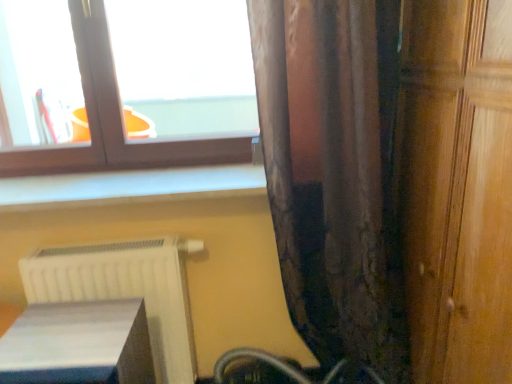
Locate an element on the screen. The image size is (512, 384). matte brown window at upper left is located at coordinates (124, 84).

You are a GUI agent. You are given a task and a screenshot of the screen. Output one action in this format:
    pyautogui.click(x=<x>, y=<y>)
    Task: Click on the wooden door at right
    This screenshot has height=384, width=512.
    Given the screenshot: What is the action you would take?
    pyautogui.click(x=458, y=188)

Locate an element on the screen. The width and height of the screenshot is (512, 384). white matte radiator at lower left is located at coordinates (126, 290).

The width and height of the screenshot is (512, 384). I want to click on white glossy book at lower left, so click(78, 344).

Describe the element at coordinates (78, 344) in the screenshot. I see `white glossy book at lower left` at that location.

Measure the distance between point (357, 206) and camera.

The depth of point (357, 206) is 4.07 feet.

What do you see at coordinates (334, 173) in the screenshot? I see `brown textured curtain at right` at bounding box center [334, 173].

This screenshot has height=384, width=512. What are the coordinates of `matte brown window at upper left` in the screenshot? It's located at (124, 84).

Who is taller, brown textured curtain at right or white matte radiator at lower left?

brown textured curtain at right.

Is brown textured curtain at right positioned far away from white matte radiator at lower left?

That's not correct — brown textured curtain at right is a little close to white matte radiator at lower left.

Is point (263, 64) closer or farther from the camera than point (169, 368)?

Point (263, 64).

Which object is positioned more to the right, brown textured curtain at right or white matte radiator at lower left?

brown textured curtain at right is more to the right.

From the picture: Considering the relative positions of white matte radiator at lower left and matte brown window at upper left in the image provided, is white matte radiator at lower left to the left or to the right of matte brown window at upper left?

From the image, it's evident that white matte radiator at lower left is to the right of matte brown window at upper left.

Which object is thinner, white matte radiator at lower left or matte brown window at upper left?

Thinner between the two is matte brown window at upper left.

How many degrees apart are the facing directions of white matte radiator at lower left and matte brown window at upper left?

1.24 degrees.

How much distance is there between white matte radiator at lower left and matte brown window at upper left?

white matte radiator at lower left and matte brown window at upper left are 24.09 inches apart.

Which object is positioned more to the right, brown textured curtain at right or white glossy book at lower left?

From the viewer's perspective, brown textured curtain at right appears more on the right side.

From the image's perspective, which is below, brown textured curtain at right or white glossy book at lower left?

white glossy book at lower left, from the image's perspective.

Considering the sizes of objects brown textured curtain at right and white glossy book at lower left in the image provided, who is shorter, brown textured curtain at right or white glossy book at lower left?

With less height is white glossy book at lower left.

Can you confirm if white matte radiator at lower left is wider than white glossy book at lower left?

In fact, white matte radiator at lower left might be narrower than white glossy book at lower left.

From the picture: Is white matte radiator at lower left bigger or smaller than white glossy book at lower left?

Considering their sizes, white matte radiator at lower left takes up more space than white glossy book at lower left.

In the scene shown: From a real-world perspective, does white matte radiator at lower left stand above white glossy book at lower left?

Incorrect, from a real-world perspective, white matte radiator at lower left is lower than white glossy book at lower left.

From the image's perspective, is matte brown window at upper left located beneath white matte radiator at lower left?

Incorrect, from the image's perspective, matte brown window at upper left is higher than white matte radiator at lower left.

Does point (65, 10) appear closer or farther from the camera than point (182, 270)?

Point (65, 10).

Consider the image. Is matte brown window at upper left facing away from white matte radiator at lower left?

No.

Could wooden door at right be considered to be inside brown textured curtain at right?

Definitely not — wooden door at right is not inside brown textured curtain at right.

Can you tell me how much brown textured curtain at right and wooden door at right differ in facing direction?

The angular difference between brown textured curtain at right and wooden door at right is 90.1 degrees.

Is brown textured curtain at right turned away from wooden door at right?

That's not correct — brown textured curtain at right is not looking away from wooden door at right.

You are a GUI agent. You are given a task and a screenshot of the screen. Output one action in this format:
    pyautogui.click(x=<x>, y=<y>)
    Task: Click on the door in front of the brown textured curtain at right
    
    Given the screenshot: What is the action you would take?
    pyautogui.click(x=458, y=188)

Looking at the image, does matte brown window at upper left seem bigger or smaller compared to brown textured curtain at right?

In the image, matte brown window at upper left appears to be smaller than brown textured curtain at right.

Consider the image. From the image's perspective, which one is positioned lower, matte brown window at upper left or brown textured curtain at right?

From the image's view, brown textured curtain at right is below.

From the picture: From a real-world perspective, is matte brown window at upper left above or below brown textured curtain at right?

matte brown window at upper left is situated higher than brown textured curtain at right in the real world.

The height and width of the screenshot is (384, 512). I want to click on radiator on the left of the brown textured curtain at right, so point(126,290).

The width and height of the screenshot is (512, 384). In order to click on radiator lying behind the matte brown window at upper left in this screenshot , I will do `click(126, 290)`.

From the image, which object appears to be farther from wooden door at right, white matte radiator at lower left or matte brown window at upper left?

matte brown window at upper left is further to wooden door at right.

Estimate the real-world distances between objects in this image. Which object is closer to white glossy book at lower left, white matte radiator at lower left or brown textured curtain at right?

white matte radiator at lower left is closer to white glossy book at lower left.

Considering their positions, is white matte radiator at lower left positioned closer to white glossy book at lower left than matte brown window at upper left?

Among the two, white matte radiator at lower left is located nearer to white glossy book at lower left.

Looking at the image, which one is located closer to wooden door at right, brown textured curtain at right or white glossy book at lower left?

brown textured curtain at right.

Consider the image. When comparing their distances from matte brown window at upper left, does brown textured curtain at right or wooden door at right seem closer?

brown textured curtain at right is positioned closer to the anchor matte brown window at upper left.

From the image, which object appears to be nearer to brown textured curtain at right, white matte radiator at lower left or wooden door at right?

wooden door at right.

Based on their spatial positions, is matte brown window at upper left or white glossy book at lower left further from brown textured curtain at right?

white glossy book at lower left is further to brown textured curtain at right.

From the picture: Looking at the image, which one is located closer to white matte radiator at lower left, wooden door at right or white glossy book at lower left?

white glossy book at lower left.

I want to click on curtain between matte brown window at upper left and white glossy book at lower left in the vertical direction, so click(x=334, y=173).

This screenshot has width=512, height=384. Identify the location of radiator between white glossy book at lower left and brown textured curtain at right in the horizontal direction. (126, 290).

Identify the location of furniture between matte brown window at upper left and wooden door at right from left to right. The width and height of the screenshot is (512, 384). (78, 344).

This screenshot has width=512, height=384. I want to click on radiator situated between white glossy book at lower left and wooden door at right from left to right, so click(126, 290).